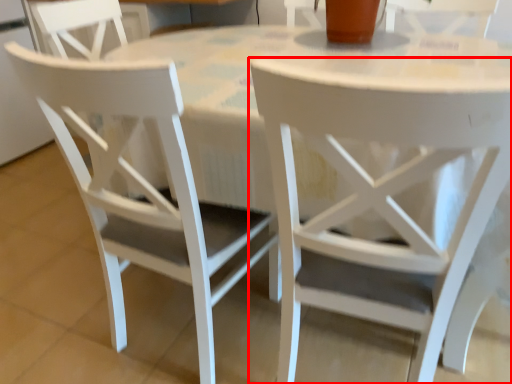
Question: From the image's perspective, where is chair (annotated by the red box) located relative to chair?

Choices:
 (A) above
 (B) below

Answer: (B)